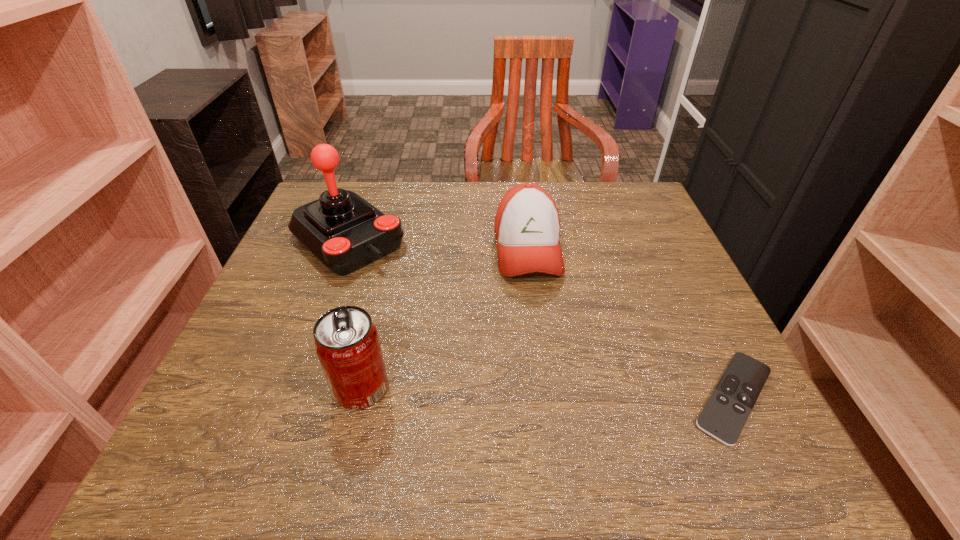
Identify the location of vacant space that satisfies the following two spatial constraints: 1. on the front side of the tallest object; 2. on the left side of the remote control. (290, 397).